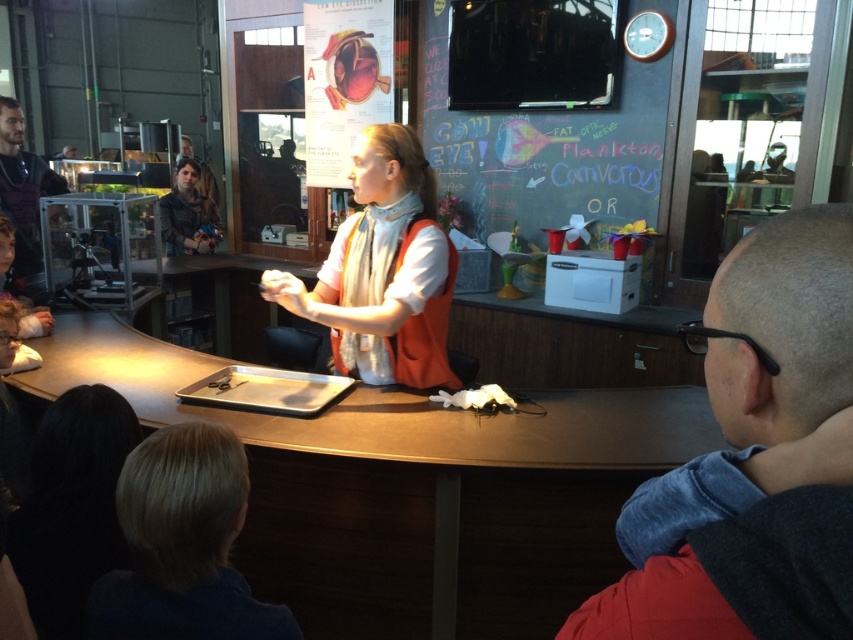
Question: Is bald head at center bigger than white matte vest at center?

Choices:
 (A) no
 (B) yes

Answer: (A)

Question: Is blonde hair at lower left above white matte vest at center?

Choices:
 (A) yes
 (B) no

Answer: (B)

Question: Is bald head at center below blonde hair at lower left?

Choices:
 (A) no
 (B) yes

Answer: (A)

Question: Estimate the real-world distances between objects in this image. Which object is farther from the wooden table at center?

Choices:
 (A) denim jacket at upper left
 (B) bald head at center
 (C) blonde hair at lower left

Answer: (A)

Question: Which point is farther from the camera taking this photo?

Choices:
 (A) (141, 481)
 (B) (804, 374)
 (C) (434, 300)
 (D) (12, 104)

Answer: (D)

Question: Which object is farther from the camera taking this photo?

Choices:
 (A) dark brown leather jacket at left
 (B) white matte vest at center
 (C) bald head at center
 (D) blonde hair at lower left

Answer: (A)